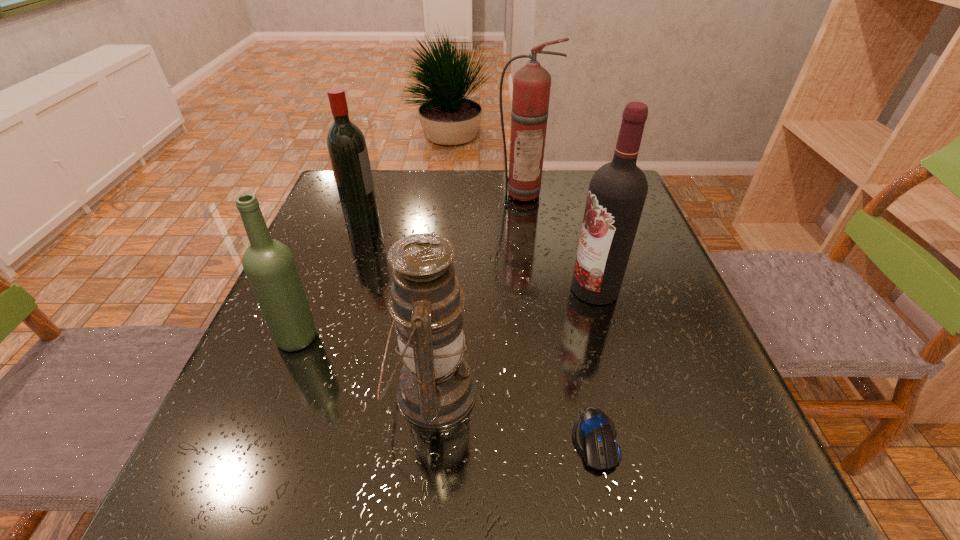
Where is `vacant space at the near edge of the desktop`? Image resolution: width=960 pixels, height=540 pixels. vacant space at the near edge of the desktop is located at coordinates (523, 472).

In the image, there is a desktop. At what (x,y) coordinates should I click in order to perform the action: click on vacant area at the left edge. Please return your answer as a coordinate pair (x, y). The width and height of the screenshot is (960, 540). Looking at the image, I should click on (274, 449).

The width and height of the screenshot is (960, 540). In order to click on vacant space at the right edge of the desktop in this screenshot , I will do `click(700, 330)`.

Where is `free spot at the far left corner of the desktop`? This screenshot has width=960, height=540. free spot at the far left corner of the desktop is located at coordinates (373, 182).

Identify the location of vacant space at the near left corner of the desktop. (293, 483).

The width and height of the screenshot is (960, 540). Find the location of `free region at the far right corner`. free region at the far right corner is located at coordinates (584, 171).

Locate an element on the screen. vacant space at the near right corner is located at coordinates (703, 478).

This screenshot has height=540, width=960. I want to click on unoccupied area between the second farthest wine bottle and the fire extinguisher, so click(559, 241).

Identify the location of vacant space in between the farthest wine bottle and the fire extinguisher. (443, 206).

The image size is (960, 540). Find the location of `vacant area between the farthest wine bottle and the shortest object`. vacant area between the farthest wine bottle and the shortest object is located at coordinates (478, 329).